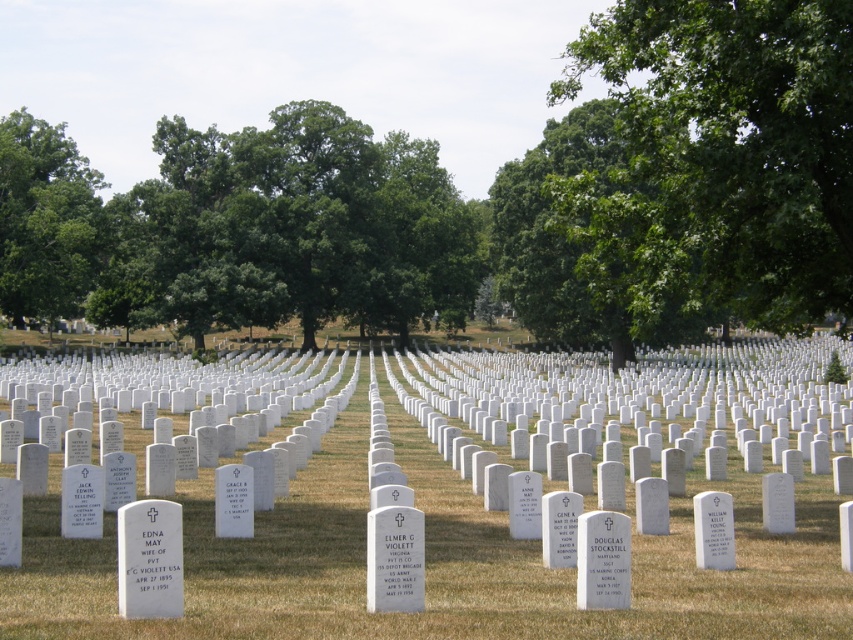
Question: Which object appears closest to the camera in this image?

Choices:
 (A) green grass at center
 (B) green leafy tree at upper left
 (C) green leafy tree at upper right

Answer: (A)

Question: Can you confirm if green grass at center is positioned below green leafy tree at upper left?

Choices:
 (A) yes
 (B) no

Answer: (A)

Question: Can you confirm if green grass at center is wider than green leafy tree at upper left?

Choices:
 (A) yes
 (B) no

Answer: (A)

Question: Among these points, which one is nearest to the camera?

Choices:
 (A) (757, 168)
 (B) (76, 150)
 (C) (670, 355)

Answer: (A)

Question: Does green leafy tree at upper right have a lesser width compared to green leafy tree at upper left?

Choices:
 (A) no
 (B) yes

Answer: (A)

Question: Which point is farther to the camera?

Choices:
 (A) (15, 138)
 (B) (602, 404)
 (C) (788, 166)

Answer: (A)